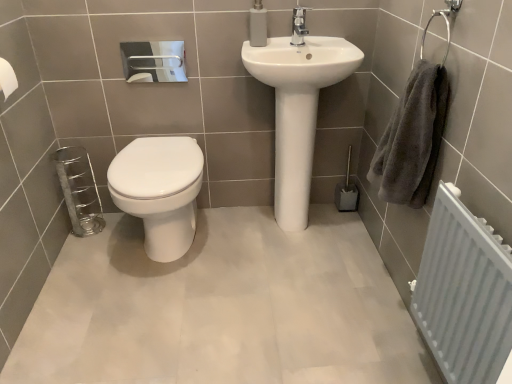
Image resolution: width=512 pixels, height=384 pixels. Find the location of `vacant area that is in front of white glossy sink at center`. vacant area that is in front of white glossy sink at center is located at coordinates (294, 272).